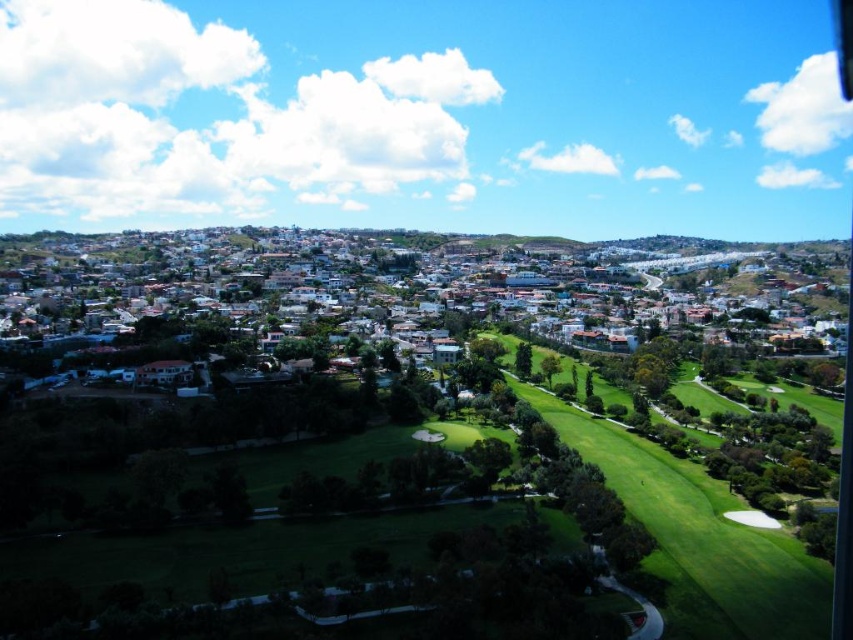
Question: Does white matte houses at center have a lesser width compared to green grassy golf course at center?

Choices:
 (A) yes
 (B) no

Answer: (B)

Question: Can you confirm if white matte houses at center is thinner than green grassy golf course at center?

Choices:
 (A) yes
 (B) no

Answer: (B)

Question: Does white matte houses at center have a larger size compared to green grassy golf course at center?

Choices:
 (A) no
 (B) yes

Answer: (B)